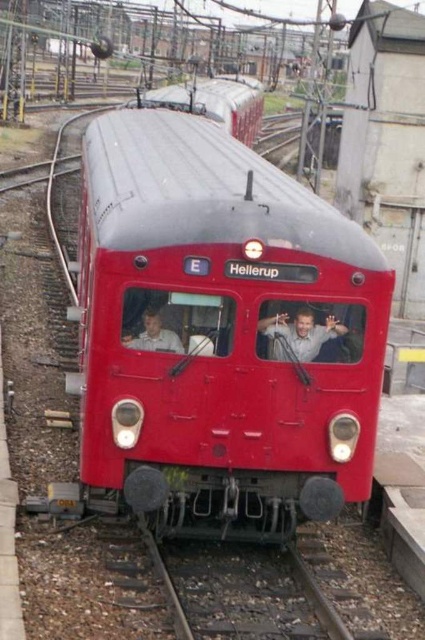
You are standing at the railway station looking at the red train. There are two points marked on the train, one at coordinates point (303, 320) and the other at point (172, 333). Which point is closer to you?

Point (172, 333) is closer to you because it is less further to the camera than point (303, 320).

You are a photographer standing at the railway station. You want to take a picture of the matte red train at center and the light beige shirt at left. Based on their sizes in the image, which object should you focus on first to ensure both are in frame?

The matte red train at center is smaller than the light beige shirt at left, so you should focus on the light beige shirt at left first to ensure both are in frame.

You are a maintenance worker standing next to the matte red train at center. You need to reach the light blue fabric shirt at center to hand over a tool. Can you reach it without moving from your current position?

The matte red train at center and the light blue fabric shirt at center are 2.13 meters apart. Since the distance is greater than an average person arm length, you cannot reach the light blue fabric shirt at center without moving.